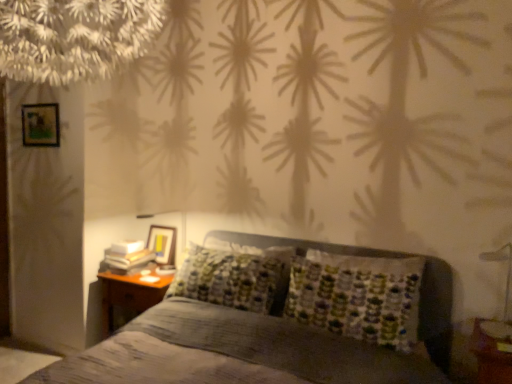
Question: Does wooden picture frame at upper left, acting as the first picture frame starting from the top, appear on the right side of woodennightstand at lower left?

Choices:
 (A) yes
 (B) no

Answer: (B)

Question: Is wooden picture frame at upper left, the first picture frame from the front, positioned beyond the bounds of woodennightstand at lower left?

Choices:
 (A) no
 (B) yes

Answer: (B)

Question: Considering the relative positions of wooden picture frame at upper left, acting as the first picture frame starting from the top, and woodennightstand at lower left in the image provided, is wooden picture frame at upper left, acting as the first picture frame starting from the top, behind woodennightstand at lower left?

Choices:
 (A) yes
 (B) no

Answer: (A)

Question: From the image's perspective, would you say wooden picture frame at upper left, the second picture frame in the bottom-to-top sequence, is shown under woodennightstand at lower left?

Choices:
 (A) yes
 (B) no

Answer: (B)

Question: Can you confirm if wooden picture frame at upper left, acting as the first picture frame starting from the left, is wider than woodennightstand at lower left?

Choices:
 (A) no
 (B) yes

Answer: (A)

Question: From a real-world perspective, is wooden picture frame at upper left, which ranks as the 2th picture frame in right-to-left order, beneath woodennightstand at lower left?

Choices:
 (A) no
 (B) yes

Answer: (A)

Question: Can you confirm if wooden picture frame at upper left, acting as the first picture frame starting from the top, is bigger than wooden glossy picture frame at upper left, which is the 1th picture frame in back-to-front order?

Choices:
 (A) no
 (B) yes

Answer: (A)

Question: Would you consider wooden picture frame at upper left, acting as the first picture frame starting from the top, to be distant from wooden glossy picture frame at upper left, which is the 1th picture frame in back-to-front order?

Choices:
 (A) yes
 (B) no

Answer: (A)

Question: Is the depth of wooden picture frame at upper left, acting as the first picture frame starting from the top, less than that of wooden glossy picture frame at upper left, the first picture frame positioned from the right?

Choices:
 (A) yes
 (B) no

Answer: (A)

Question: From the image's perspective, is wooden picture frame at upper left, which ranks as the 2th picture frame in right-to-left order, under wooden glossy picture frame at upper left, the second picture frame positioned from the left?

Choices:
 (A) yes
 (B) no

Answer: (B)

Question: Considering the relative sizes of wooden picture frame at upper left, which ranks as the 2th picture frame in right-to-left order, and wooden glossy picture frame at upper left, acting as the 2th picture frame starting from the top, in the image provided, is wooden picture frame at upper left, which ranks as the 2th picture frame in right-to-left order, smaller than wooden glossy picture frame at upper left, acting as the 2th picture frame starting from the top,?

Choices:
 (A) no
 (B) yes

Answer: (B)

Question: Is wooden picture frame at upper left, acting as the first picture frame starting from the left, located outside wooden glossy picture frame at upper left, the second picture frame positioned from the left?

Choices:
 (A) no
 (B) yes

Answer: (B)

Question: Is metallic silver bedside lamp at lower right a part of textured gray bed at center?

Choices:
 (A) yes
 (B) no

Answer: (A)